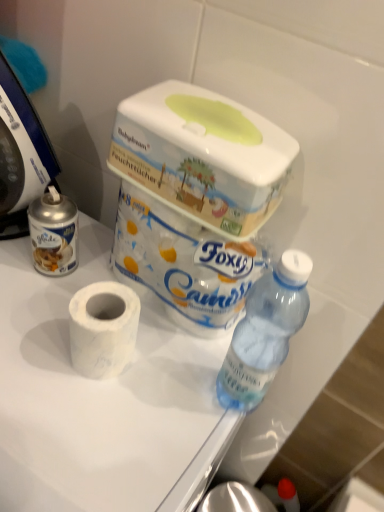
The image size is (384, 512). Find the location of `free spot above white matte toilet paper at center (from a real-world perspective)`. free spot above white matte toilet paper at center (from a real-world perspective) is located at coordinates (93, 364).